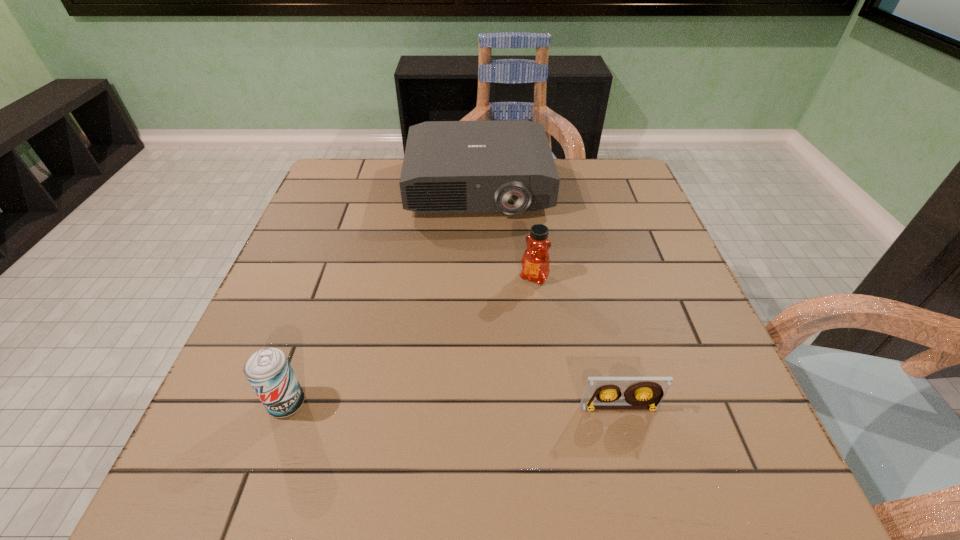
Identify the location of free spot at the right edge of the desktop. The height and width of the screenshot is (540, 960). (605, 217).

In the image, there is a desktop. Identify the location of free space at the far left corner. This screenshot has width=960, height=540. (330, 197).

You are a GUI agent. You are given a task and a screenshot of the screen. Output one action in this format:
    pyautogui.click(x=<x>, y=<y>)
    Task: Click on the vacant space at the near left corner of the desktop
    
    Given the screenshot: What is the action you would take?
    pyautogui.click(x=293, y=416)

Where is `free space between the beer can and the projector`? free space between the beer can and the projector is located at coordinates click(x=382, y=295).

At what (x,y) coordinates should I click in order to perform the action: click on free space between the videotape and the leftmost object. Please return your answer as a coordinate pair (x, y). Looking at the image, I should click on (x=453, y=406).

The image size is (960, 540). I want to click on free space between the videotape and the honey, so click(x=577, y=342).

At what (x,y) coordinates should I click in order to perform the action: click on vacant area between the projector and the beer can. Please return your answer as a coordinate pair (x, y). This screenshot has height=540, width=960. Looking at the image, I should click on (382, 295).

This screenshot has height=540, width=960. I want to click on free space between the honey and the shortest object, so click(x=577, y=342).

This screenshot has width=960, height=540. Identify the location of vacant point located between the beer can and the shortest object. (453, 406).

This screenshot has width=960, height=540. What are the coordinates of `vacant area between the second farthest object and the videotape` in the screenshot? It's located at (577, 342).